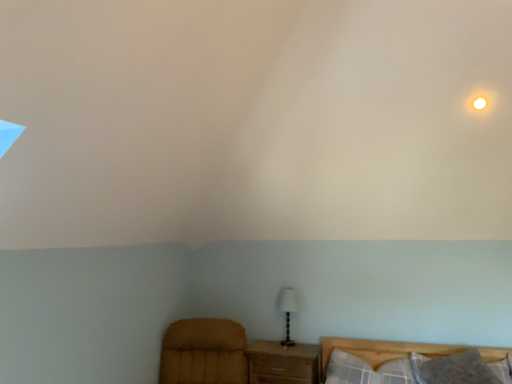
Question: Should I look upward or downward to see plaid fabric pillow at lower right, the 1th pillow positioned from the left?

Choices:
 (A) up
 (B) down

Answer: (B)

Question: Should I look upward or downward to see velvet brown armchair at lower left?

Choices:
 (A) up
 (B) down

Answer: (B)

Question: Is white glossy light at upper right surrounding white fabric lampshade at center?

Choices:
 (A) no
 (B) yes

Answer: (A)

Question: Does white glossy light at upper right have a smaller size compared to white fabric lampshade at center?

Choices:
 (A) no
 (B) yes

Answer: (B)

Question: From the image's perspective, does white glossy light at upper right appear higher than white fabric lampshade at center?

Choices:
 (A) yes
 (B) no

Answer: (A)

Question: Considering the relative positions of white glossy light at upper right and white fabric lampshade at center in the image provided, is white glossy light at upper right to the right of white fabric lampshade at center from the viewer's perspective?

Choices:
 (A) no
 (B) yes

Answer: (B)

Question: Is white glossy light at upper right at the left side of white fabric lampshade at center?

Choices:
 (A) yes
 (B) no

Answer: (B)

Question: Is white glossy light at upper right not within white fabric lampshade at center?

Choices:
 (A) yes
 (B) no

Answer: (A)

Question: Is white fabric lampshade at center completely or partially inside plaid fabric pillow at lower right, the 1th pillow positioned from the left?

Choices:
 (A) no
 (B) yes

Answer: (A)

Question: Can you confirm if plaid fabric pillow at lower right, the 1th pillow positioned from the left, is bigger than white fabric lampshade at center?

Choices:
 (A) no
 (B) yes

Answer: (B)

Question: Is plaid fabric pillow at lower right, the 1th pillow positioned from the left, at the left side of white fabric lampshade at center?

Choices:
 (A) no
 (B) yes

Answer: (A)

Question: Does plaid fabric pillow at lower right, the second pillow when ordered from right to left, turn towards white fabric lampshade at center?

Choices:
 (A) yes
 (B) no

Answer: (B)

Question: Considering the relative positions of plaid fabric pillow at lower right, the 1th pillow positioned from the left, and white fabric lampshade at center in the image provided, is plaid fabric pillow at lower right, the 1th pillow positioned from the left, in front of white fabric lampshade at center?

Choices:
 (A) no
 (B) yes

Answer: (B)

Question: Considering the relative sizes of plaid fabric pillow at lower right, the 1th pillow positioned from the left, and white fabric lampshade at center in the image provided, is plaid fabric pillow at lower right, the 1th pillow positioned from the left, smaller than white fabric lampshade at center?

Choices:
 (A) no
 (B) yes

Answer: (A)

Question: Can you confirm if wooden nightstand at lower center is shorter than velvet brown armchair at lower left?

Choices:
 (A) yes
 (B) no

Answer: (A)